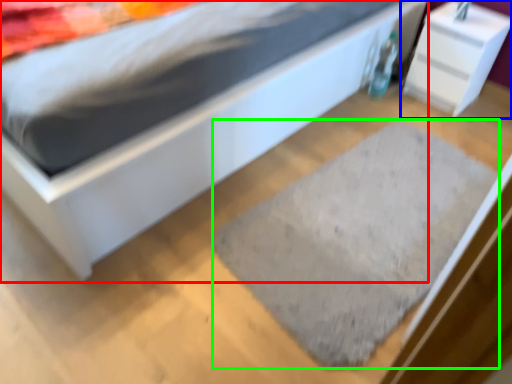
Question: Which object is positioned closest to bed (highlighted by a red box)? Select from nightstand (highlighted by a blue box) and doormat (highlighted by a green box).

Choices:
 (A) nightstand
 (B) doormat

Answer: (B)